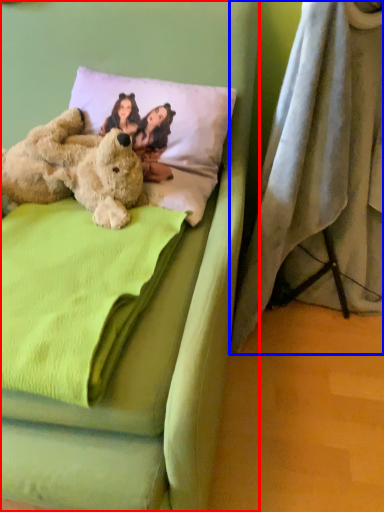
Question: Which of the following is the farthest to the observer, bed (highlighted by a red box) or curtain (highlighted by a blue box)?

Choices:
 (A) bed
 (B) curtain

Answer: (B)